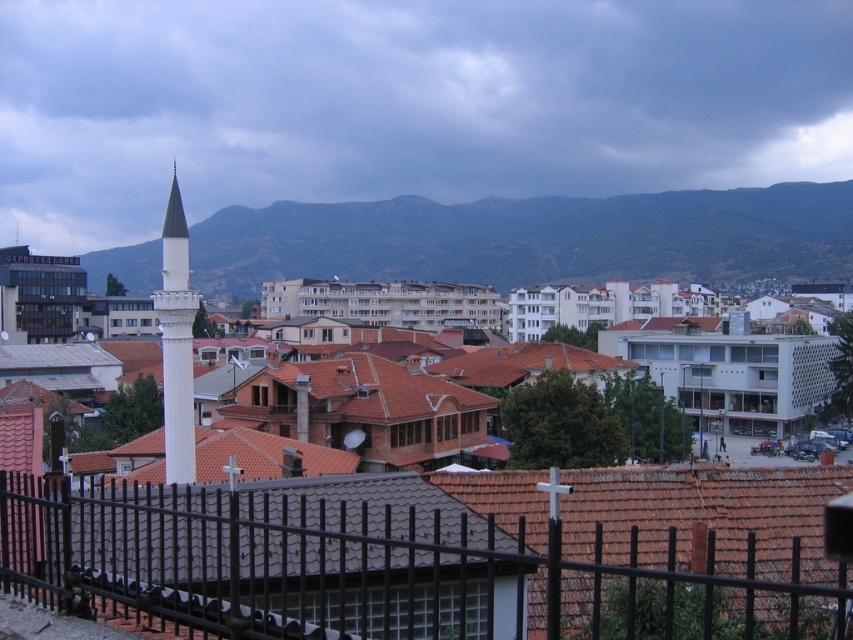
Question: Is green textured mountain at upper center thinner than white marble minaret at center-left?

Choices:
 (A) yes
 (B) no

Answer: (B)

Question: Based on their relative distances, which object is nearer to the white marble minaret at center-left?

Choices:
 (A) black metal fence at lower center
 (B) green textured mountain at upper center

Answer: (A)

Question: Can you confirm if black metal fence at lower center is positioned above white smooth minaret at center?

Choices:
 (A) no
 (B) yes

Answer: (B)

Question: Is black metal fence at lower center thinner than green textured mountain at upper center?

Choices:
 (A) yes
 (B) no

Answer: (A)

Question: Which point is farther to the camera?

Choices:
 (A) (175, 164)
 (B) (592, 608)

Answer: (A)

Question: Which of the following is the farthest from the observer?

Choices:
 (A) click(x=57, y=513)
 (B) click(x=659, y=273)
 (C) click(x=103, y=515)

Answer: (B)